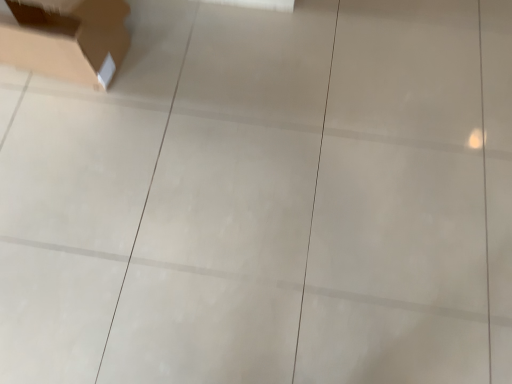
Find the location of a particular element. unoccupied area in front of brown cardboard box at upper left is located at coordinates (75, 148).